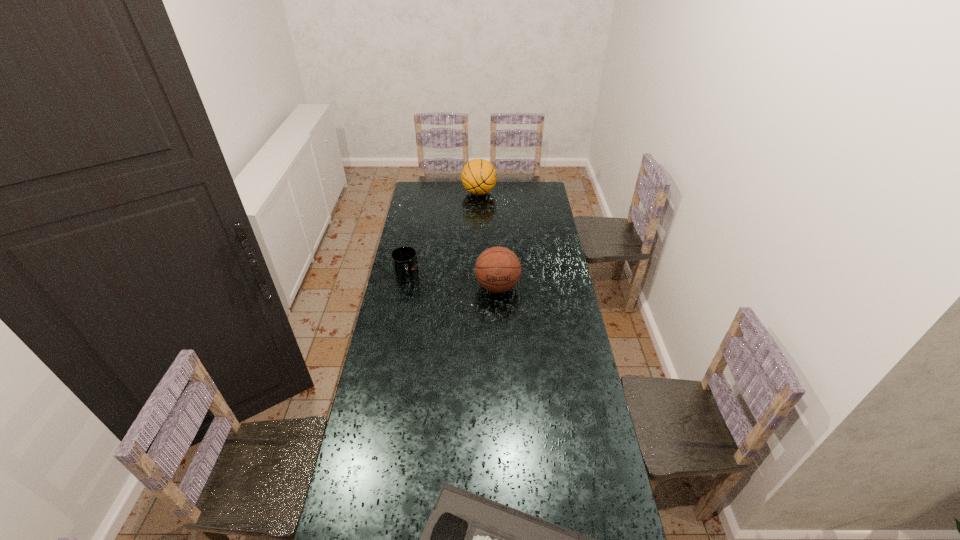
In the image, there is a desktop. In order to click on free region at the left edge in this screenshot , I will do (x=415, y=303).

In the image, there is a desktop. Identify the location of vacant space at the right edge. (586, 351).

The image size is (960, 540). In the image, there is a desktop. What are the coordinates of `vacant region at the far left corner` in the screenshot? It's located at (432, 182).

I want to click on blank space at the far right corner, so click(522, 186).

Where is `free space between the farthest object and the nearer basketball`? The width and height of the screenshot is (960, 540). free space between the farthest object and the nearer basketball is located at coordinates (488, 240).

You are a GUI agent. You are given a task and a screenshot of the screen. Output one action in this format:
    pyautogui.click(x=<x>, y=<y>)
    Task: Click on the free area in between the farthest object and the mug
    The width and height of the screenshot is (960, 540).
    Given the screenshot: What is the action you would take?
    pyautogui.click(x=443, y=235)

You are a GUI agent. You are given a task and a screenshot of the screen. Output one action in this format:
    pyautogui.click(x=<x>, y=<y>)
    Task: Click on the free space between the farther basketball and the nearer basketball
    This screenshot has height=540, width=960.
    Given the screenshot: What is the action you would take?
    pyautogui.click(x=488, y=240)

Identify the location of empty space that is in between the mug and the nearer basketball. (452, 282).

Locate an element on the screen. This screenshot has height=540, width=960. blank region between the third tallest object and the nearer basketball is located at coordinates (452, 282).

Locate an element on the screen. Image resolution: width=960 pixels, height=540 pixels. free spot between the nearer basketball and the mug is located at coordinates (452, 282).